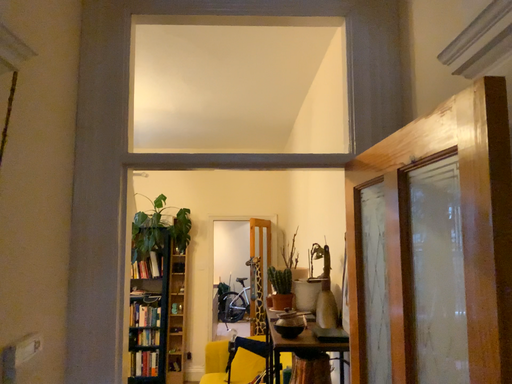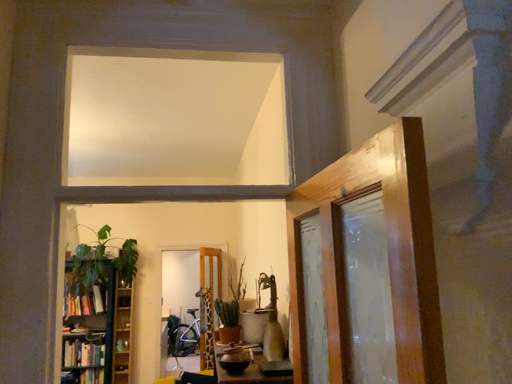
Question: How did the camera likely rotate when shooting the video?

Choices:
 (A) rotated left
 (B) rotated right

Answer: (B)